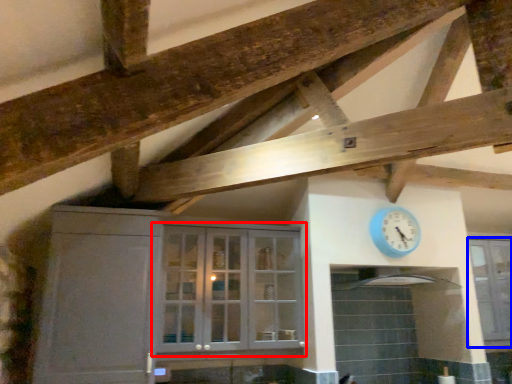
Question: Which object is further to the camera taking this photo, cupboard (highlighted by a red box) or window (highlighted by a blue box)?

Choices:
 (A) cupboard
 (B) window

Answer: (B)